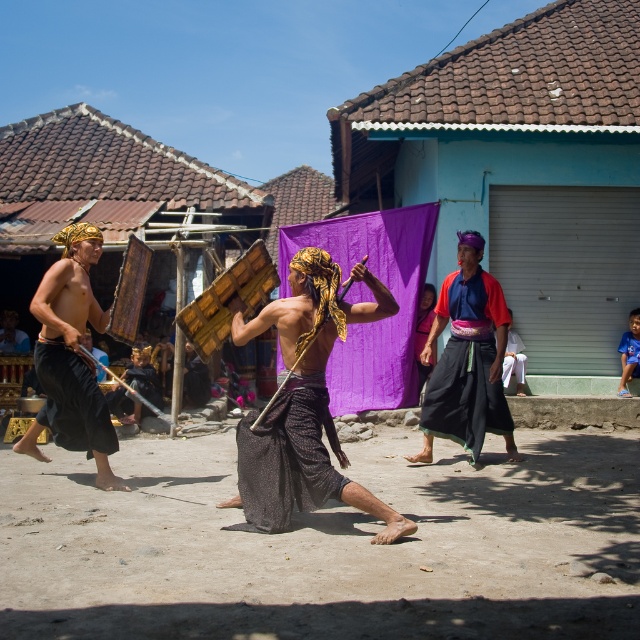
Question: Is purple fabric at center to the right of black cotton skirt at left from the viewer's perspective?

Choices:
 (A) yes
 (B) no

Answer: (A)

Question: Among these points, which one is farthest from the camera?

Choices:
 (A) (260, 472)
 (B) (84, 396)
 (C) (84, 420)

Answer: (C)

Question: Which of the following is the farthest from the observer?

Choices:
 (A) (84, 436)
 (B) (480, 310)
 (C) (116, 529)

Answer: (B)

Question: Is matte brown wooden staff at center smaller than dark blue cotton robe at center?

Choices:
 (A) yes
 (B) no

Answer: (B)

Question: Where is matte brown wooden staff at center located in relation to black textured cloth at center in the image?

Choices:
 (A) below
 (B) above

Answer: (B)

Question: Which is farther from the dark blue cotton robe at center?

Choices:
 (A) dirt field at center
 (B) matte black shield at left
 (C) purple fabric at center

Answer: (B)